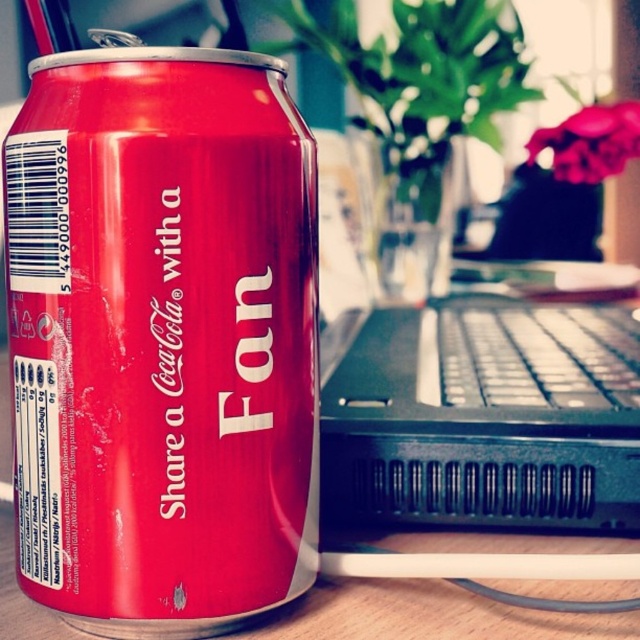
Question: Is matte red can at center further to the viewer compared to black plastic keyboard at center?

Choices:
 (A) no
 (B) yes

Answer: (A)

Question: Where is matte red can at center located in relation to black plastic keyboard at center in the image?

Choices:
 (A) below
 (B) above

Answer: (A)

Question: Does matte red can at center have a lesser width compared to black plastic keyboard at center?

Choices:
 (A) yes
 (B) no

Answer: (A)

Question: Which of the following is the farthest from the observer?

Choices:
 (A) (259, 360)
 (B) (628, 352)

Answer: (B)